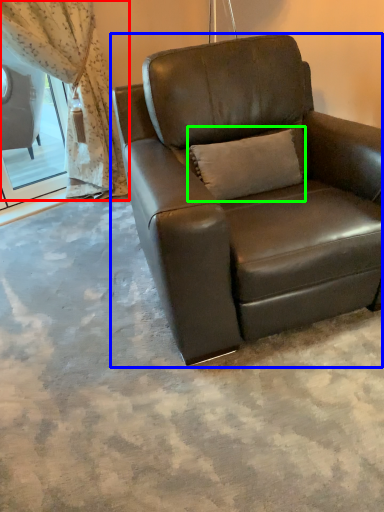
Question: Based on their relative distances, which object is farther from curtain (highlighted by a red box)? Choose from chair (highlighted by a blue box) and pillow (highlighted by a green box).

Choices:
 (A) chair
 (B) pillow

Answer: (B)